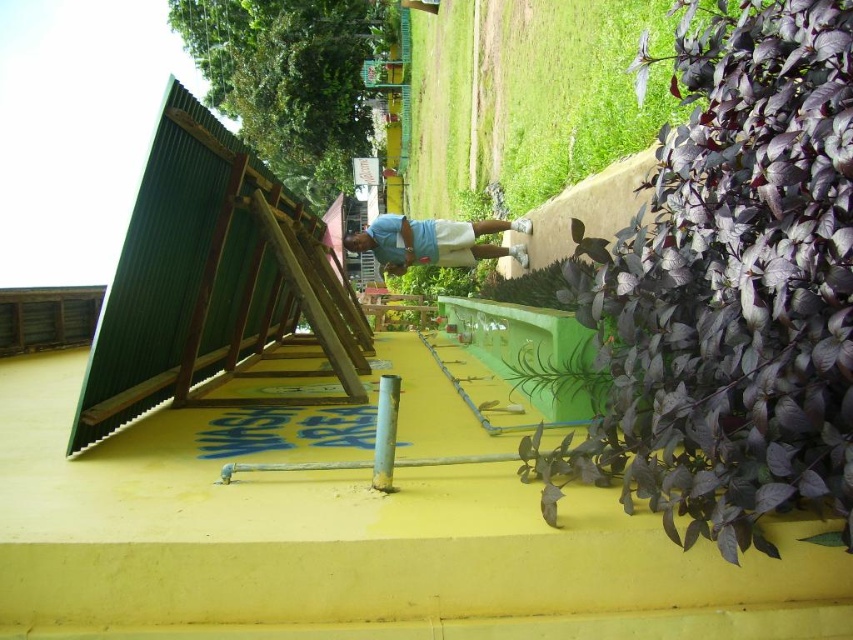
Question: Does purple matte leaves at upper right appear on the right side of green leafy plant at center?

Choices:
 (A) yes
 (B) no

Answer: (A)

Question: Is light blue fabric at center positioned in front of green leafy plant at center?

Choices:
 (A) yes
 (B) no

Answer: (B)

Question: Which of these objects is positioned farthest from the light blue fabric at center?

Choices:
 (A) purple matte leaves at upper right
 (B) purple leafy plant at center
 (C) green leafy plant at center

Answer: (A)

Question: Is light blue fabric at center thinner than purple leafy plant at center?

Choices:
 (A) yes
 (B) no

Answer: (B)

Question: Which object is closer to the camera taking this photo?

Choices:
 (A) purple leafy plant at center
 (B) light blue fabric at center

Answer: (A)

Question: Which of the following is the farthest from the observer?

Choices:
 (A) (573, 264)
 (B) (599, 355)

Answer: (A)